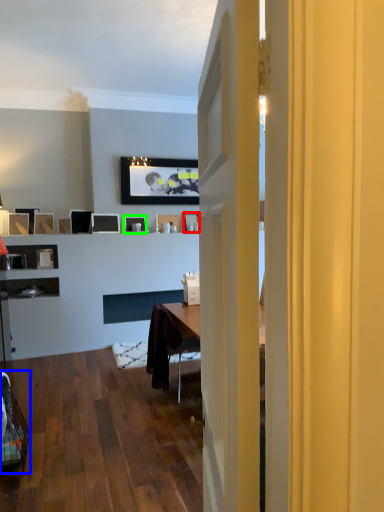
Question: Considering the real-world distances, which object is closest to picture frame (highlighted by a red box)? swivel chair (highlighted by a blue box) or picture frame (highlighted by a green box).

Choices:
 (A) swivel chair
 (B) picture frame

Answer: (B)